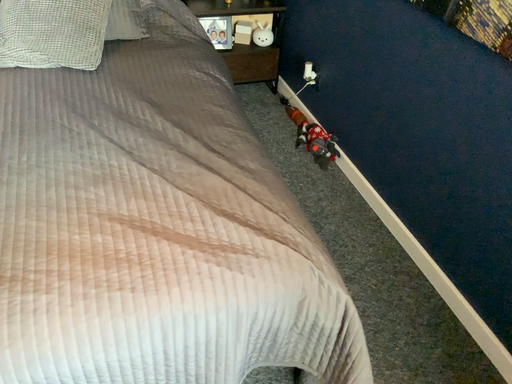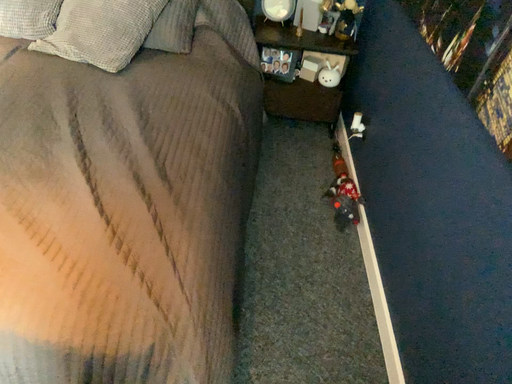
Question: How did the camera likely rotate when shooting the video?

Choices:
 (A) rotated left
 (B) rotated right

Answer: (A)